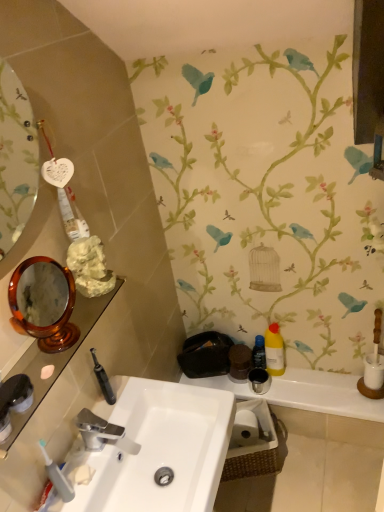
Identify the location of amber glass mirror at left. Image resolution: width=384 pixels, height=512 pixels. (44, 303).

Identify the location of silver metallic faucet at center. (103, 433).

What is the approximate width of matte black tray at lower center?

matte black tray at lower center is 8.48 inches wide.

You are a GUI agent. You are given a task and a screenshot of the screen. Output one action in this format:
    pyautogui.click(x=<x>, y=<y>)
    Task: Click on the matte black tray at lower center
    
    Given the screenshot: What is the action you would take?
    pyautogui.click(x=306, y=393)

The image size is (384, 512). Describe the element at coordinates (274, 351) in the screenshot. I see `yellow matte bottle at right, the 1th mouthwash viewed from the right` at that location.

Describe the element at coordinates (259, 353) in the screenshot. I see `black plastic bottle at right, the 1th mouthwash in the left-to-right sequence` at that location.

From the picture: What is the approximate height of white matte toilet paper at lower center?

It is 6.70 inches.

This screenshot has height=512, width=384. Identify the location of amber glass mirror at left. (44, 303).

From the image's perspective, who appears lower, silver metallic faucet at center or yellow matte bottle at right, placed as the 2th mouthwash when sorted from left to right?

silver metallic faucet at center is shown below in the image.

Would you say silver metallic faucet at center is inside or outside yellow matte bottle at right, the 1th mouthwash viewed from the right?

silver metallic faucet at center is not inside yellow matte bottle at right, the 1th mouthwash viewed from the right, it's outside.

From a real-world perspective, which is physically above, silver metallic faucet at center or yellow matte bottle at right, the 1th mouthwash viewed from the right?

silver metallic faucet at center is physically above.

This screenshot has height=512, width=384. What are the coordinates of `tap to the left of yellow matte bottle at right, the 1th mouthwash viewed from the right` in the screenshot? It's located at (103, 433).

Does amber glass mirror at left come behind white glossy sink at center?

No, it is in front of white glossy sink at center.

From a real-world perspective, is amber glass mirror at left beneath white glossy sink at center?

No.

How many degrees apart are the facing directions of amber glass mirror at left and white glossy sink at center?

They differ by 10.1 degrees in their facing directions.

In the scene shown: Is white glossy sink at center inside amber glass mirror at left?

Actually, white glossy sink at center is outside amber glass mirror at left.

Between yellow matte bottle at right, the 1th mouthwash viewed from the right, and silver metallic faucet at center, which one has less height?

With less height is silver metallic faucet at center.

Is yellow matte bottle at right, placed as the 2th mouthwash when sorted from left to right, oriented towards silver metallic faucet at center?

No, yellow matte bottle at right, placed as the 2th mouthwash when sorted from left to right, is not turned towards silver metallic faucet at center.

Would you consider yellow matte bottle at right, the 1th mouthwash viewed from the right, to be distant from silver metallic faucet at center?

No, yellow matte bottle at right, the 1th mouthwash viewed from the right, is not far away from silver metallic faucet at center.

How far apart are yellow matte bottle at right, the 1th mouthwash viewed from the right, and silver metallic faucet at center?

They are 36.61 inches apart.

Between translucent plastic toothbrush at lower left and black plastic bottle at right, the 1th mouthwash in the left-to-right sequence, which one is positioned behind?

black plastic bottle at right, the 1th mouthwash in the left-to-right sequence, is behind.

Who is bigger, translucent plastic toothbrush at lower left or black plastic bottle at right, the 1th mouthwash in the left-to-right sequence?

Bigger between the two is black plastic bottle at right, the 1th mouthwash in the left-to-right sequence.

From a real-world perspective, does translucent plastic toothbrush at lower left sit lower than black plastic bottle at right, which is counted as the 2th mouthwash, starting from the right?

No, from a real-world perspective, translucent plastic toothbrush at lower left is not under black plastic bottle at right, which is counted as the 2th mouthwash, starting from the right.

Is translucent plastic toothbrush at lower left positioned beyond the bounds of black plastic bottle at right, the 1th mouthwash in the left-to-right sequence?

Yes, translucent plastic toothbrush at lower left is located beyond the bounds of black plastic bottle at right, the 1th mouthwash in the left-to-right sequence.

Does point (116, 503) come behind point (253, 362)?

No, it is not.

In terms of height, does white glossy sink at center look taller or shorter compared to black plastic bottle at right, the 1th mouthwash in the left-to-right sequence?

In the image, white glossy sink at center appears to be taller than black plastic bottle at right, the 1th mouthwash in the left-to-right sequence.

Are white glossy sink at center and black plastic bottle at right, which is counted as the 2th mouthwash, starting from the right, making contact?

No, white glossy sink at center is not in contact with black plastic bottle at right, which is counted as the 2th mouthwash, starting from the right.

There is a white glossy sink at center. Where is `the 1st mouthwash above it (from the image's perspective)`? the 1st mouthwash above it (from the image's perspective) is located at coordinates (259, 353).

From the image's perspective, between amber glass mirror at left and translucent plastic toothbrush at lower left, which one is located above?

amber glass mirror at left.

Is amber glass mirror at left facing towards translucent plastic toothbrush at lower left?

No, amber glass mirror at left does not turn towards translucent plastic toothbrush at lower left.

This screenshot has width=384, height=512. In order to click on mirror lying on the right of translucent plastic toothbrush at lower left in this screenshot , I will do `click(44, 303)`.

How different are the orientations of amber glass mirror at left and translucent plastic toothbrush at lower left in degrees?

62.1 degrees separate the facing orientations of amber glass mirror at left and translucent plastic toothbrush at lower left.

Does point (54, 467) come behind point (242, 443)?

No, (54, 467) is closer to viewer.

Looking at this image, is translucent plastic toothbrush at lower left oriented away from white matte toilet paper at lower center?

No, translucent plastic toothbrush at lower left's orientation is not away from white matte toilet paper at lower center.

Considering the relative sizes of translucent plastic toothbrush at lower left and white matte toilet paper at lower center in the image provided, is translucent plastic toothbrush at lower left bigger than white matte toilet paper at lower center?

No, translucent plastic toothbrush at lower left is not bigger than white matte toilet paper at lower center.

Identify the location of tap above the yellow matte bottle at right, the 1th mouthwash viewed from the right (from a real-world perspective). The image size is (384, 512). (103, 433).

Where is `sink that is on the right side of amber glass mirror at left`? Image resolution: width=384 pixels, height=512 pixels. sink that is on the right side of amber glass mirror at left is located at coordinates (156, 450).

Considering their positions, is amber glass mirror at left positioned further to translucent plastic toothbrush at lower left than white glossy sink at center?

amber glass mirror at left lies further to translucent plastic toothbrush at lower left than the other object.

Which object lies nearer to the anchor point white glossy sink at center, white matte toilet paper at lower center or matte black tray at lower center?

white matte toilet paper at lower center is closer to white glossy sink at center.

Considering their positions, is translucent plastic toothbrush at lower left positioned further to white glossy sink at center than amber glass mirror at left?

amber glass mirror at left is further to white glossy sink at center.

Estimate the real-world distances between objects in this image. Which object is closer to white glossy sink at center, matte black tray at lower center or white matte toilet paper at lower center?

The object closer to white glossy sink at center is white matte toilet paper at lower center.

Considering their positions, is matte black tray at lower center positioned further to silver metallic faucet at center than black plastic bottle at right, which is counted as the 2th mouthwash, starting from the right?

The object further to silver metallic faucet at center is black plastic bottle at right, which is counted as the 2th mouthwash, starting from the right.

Considering their positions, is yellow matte bottle at right, the 1th mouthwash viewed from the right, positioned further to matte black tray at lower center than white matte toilet paper at lower center?

Based on the image, white matte toilet paper at lower center appears to be further to matte black tray at lower center.

Looking at this image, looking at the image, which one is located closer to matte black tray at lower center, yellow matte bottle at right, placed as the 2th mouthwash when sorted from left to right, or silver metallic faucet at center?

yellow matte bottle at right, placed as the 2th mouthwash when sorted from left to right, is closer to matte black tray at lower center.

Looking at the image, which one is located closer to amber glass mirror at left, black plastic bottle at right, which is counted as the 2th mouthwash, starting from the right, or yellow matte bottle at right, the 1th mouthwash viewed from the right?

The object closer to amber glass mirror at left is black plastic bottle at right, which is counted as the 2th mouthwash, starting from the right.

Where is `tap located between white glossy sink at center and black plastic bottle at right, the 1th mouthwash in the left-to-right sequence, in the depth direction`? tap located between white glossy sink at center and black plastic bottle at right, the 1th mouthwash in the left-to-right sequence, in the depth direction is located at coordinates (103, 433).

At what (x,y) coordinates should I click in order to perform the action: click on mouthwash between white glossy sink at center and black plastic bottle at right, the 1th mouthwash in the left-to-right sequence, in the front-back direction. Please return your answer as a coordinate pair (x, y). Looking at the image, I should click on (274, 351).

Identify the location of counter top located between silver metallic faucet at center and white matte toilet paper at lower center in the depth direction. (306, 393).

You are a GUI agent. You are given a task and a screenshot of the screen. Output one action in this format:
    pyautogui.click(x=<x>, y=<y>)
    Task: Click on the toilet paper between translucent plastic toothbrush at lower left and black plastic bottle at right, which is counted as the 2th mouthwash, starting from the right, along the z-axis
    The height and width of the screenshot is (512, 384).
    Given the screenshot: What is the action you would take?
    pyautogui.click(x=244, y=429)